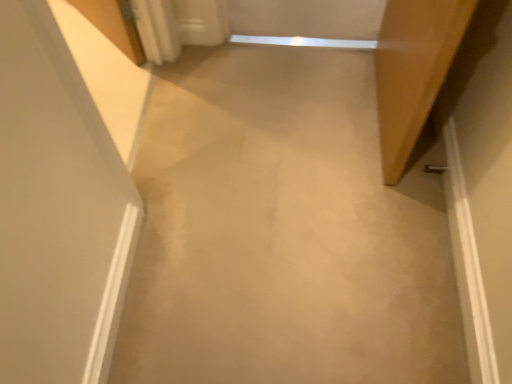
Find the location of a particular element. The width and height of the screenshot is (512, 384). beige carpet at center is located at coordinates (282, 232).

What is the approximate width of beige carpet at center?

The width of beige carpet at center is 1.52 meters.

Measure the distance between point (239, 350) and camera.

1.32 meters.

What do you see at coordinates (282, 232) in the screenshot? This screenshot has width=512, height=384. I see `beige carpet at center` at bounding box center [282, 232].

Identify the location of beige carpet at center. The width and height of the screenshot is (512, 384). (282, 232).